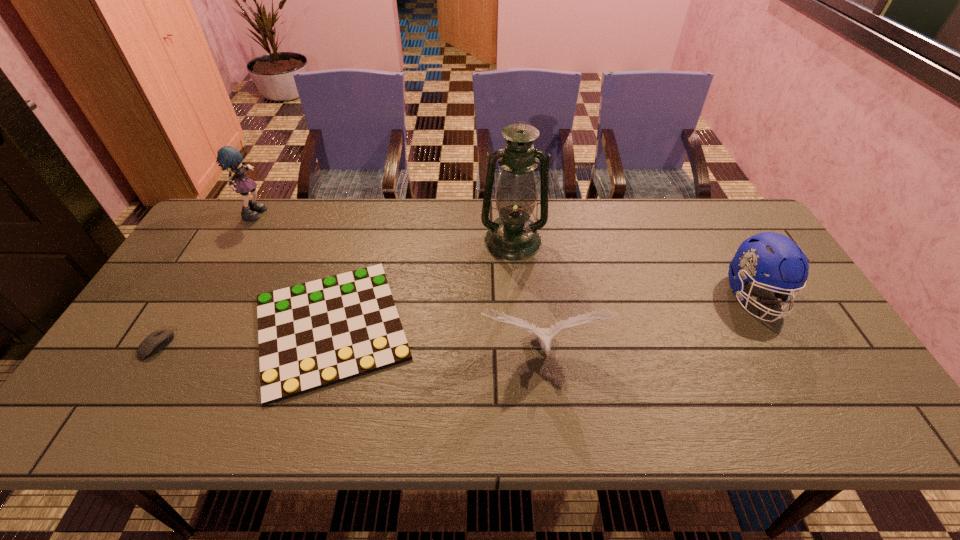
What are the coordinates of `blank space located on the front-facing side of the rag doll` in the screenshot? It's located at (316, 211).

At what (x,y) coordinates should I click in order to perform the action: click on free space located 0.220m on the face guard of the football helmet. Please return your answer as a coordinate pair (x, y). This screenshot has height=540, width=960. Looking at the image, I should click on (818, 406).

Find the location of a particular element. Image resolution: width=960 pixels, height=540 pixels. free space located 0.130m at the tip of the beak of the gull is located at coordinates (551, 427).

This screenshot has height=540, width=960. What are the coordinates of `vacant space located on the right of the computer equipment` in the screenshot? It's located at (206, 345).

At what (x,y) coordinates should I click in order to perform the action: click on free space located on the right of the shortest object. Please return your answer as a coordinate pair (x, y). Looking at the image, I should click on (514, 327).

I want to click on oil lamp located in the far edge section of the desktop, so click(x=513, y=236).

Where is `rag doll at the far edge`? rag doll at the far edge is located at coordinates (228, 157).

At what (x,y) coordinates should I click in order to perform the action: click on object located in the near edge section of the desktop. Please return your answer as a coordinate pair (x, y). Image resolution: width=960 pixels, height=540 pixels. Looking at the image, I should click on (311, 335).

The image size is (960, 540). I want to click on rag doll at the left edge, so [x=228, y=157].

Where is `computer equipment at the left edge`? This screenshot has height=540, width=960. computer equipment at the left edge is located at coordinates (156, 341).